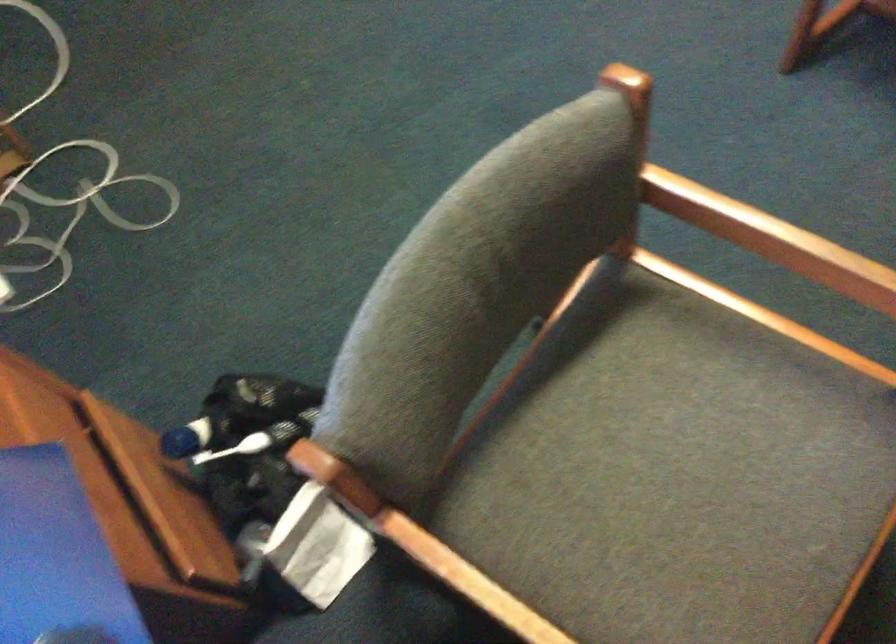
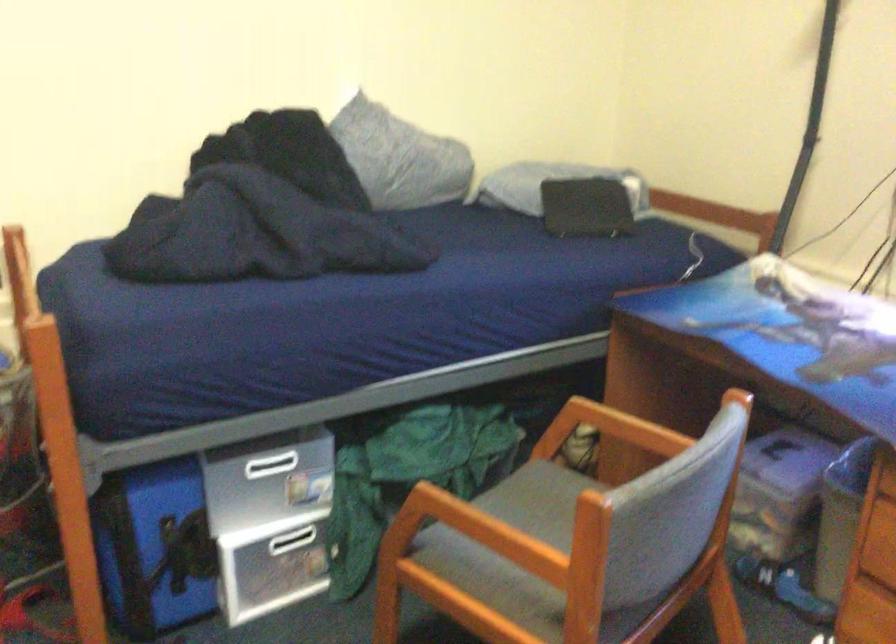
Question: I am providing you with two images of the same scene from different viewpoints. After the viewpoint changes to image2, which objects are now occluded?

Choices:
 (A) storage box handle
 (B) blue bucket handle
 (C) wooden chair armrest
 (D) black rectangular object

Answer: (C)